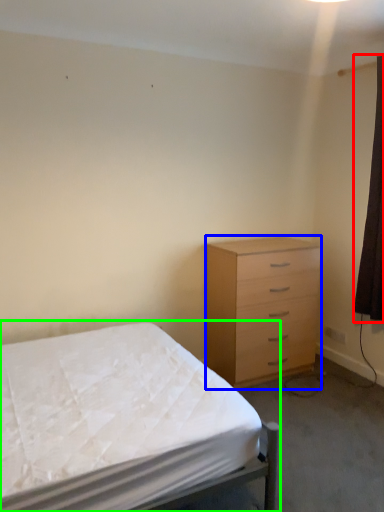
Question: Which object is positioned closest to curtain (highlighted by a red box)? Select from chest of drawers (highlighted by a blue box) and bed (highlighted by a green box).

Choices:
 (A) chest of drawers
 (B) bed

Answer: (A)